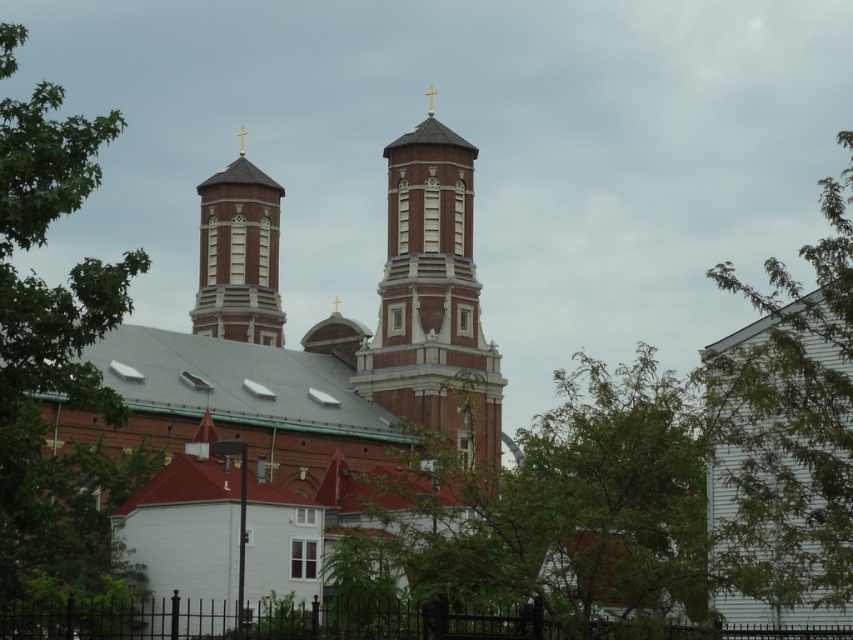
From the picture: You are standing in front of the church and want to take a photo of the matte brick tower at upper left without any obstructions. Is there a green leafy tree at left blocking your view of the tower?

The green leafy tree at left is to the left of the matte brick tower at upper left, so it would not block the view of the tower since it is positioned to the side rather than in front.

You are standing at the entrance of the property and want to take a photo of the brick church at center. Given that your camera has a field of view that can capture objects within a 100cm radius, and you are currently 120cm away from the church, can you adjust your position to include the entire church in the photo without moving closer than 100cm?

Since you are 120cm away from the brick church at center and your camera can capture within a 100cm radius, you need to move closer. However, you cannot move closer than 100cm. Therefore, you must position yourself exactly 100cm away to ensure the entire church fits within the camera field of view.

You are a photographer planning to capture the church and its surroundings. You notice the green leafy tree at right and the matte brick tower at upper left in your viewfinder. Which object will appear taller in the final photo?

The green leafy tree at right will appear taller in the final photo because it has a greater height compared to the matte brick tower at upper left.